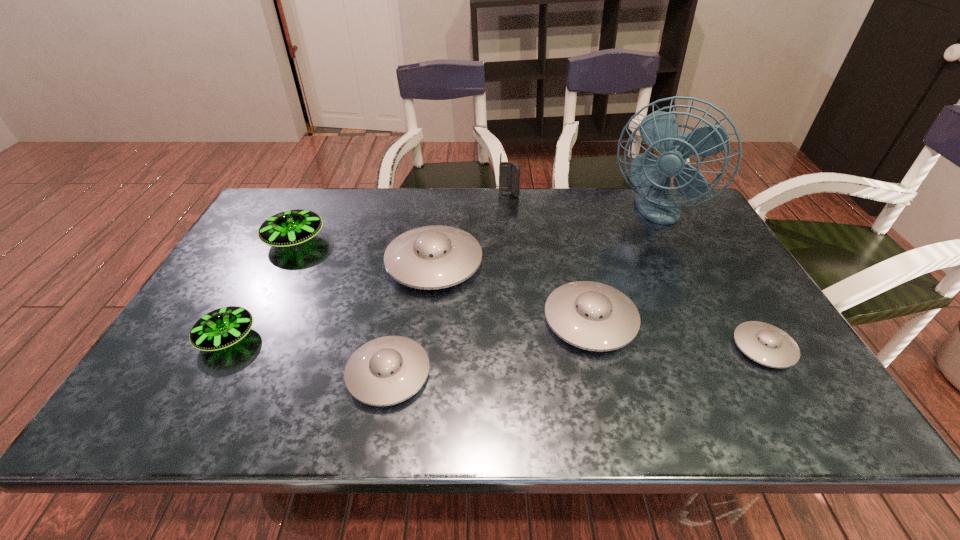
Locate an element on the screen. The width and height of the screenshot is (960, 540). vacant space at the right edge of the desktop is located at coordinates pos(765,308).

This screenshot has width=960, height=540. In the image, there is a desktop. Find the location of `free region at the near left corner`. free region at the near left corner is located at coordinates (189, 404).

This screenshot has width=960, height=540. Identify the location of vacant space at the far right corner of the desktop. (695, 221).

Locate an element on the screen. vacant space at the near right corner is located at coordinates (747, 400).

The width and height of the screenshot is (960, 540). I want to click on blank region between the seventh shortest object and the smallest gray saucer, so click(636, 271).

This screenshot has width=960, height=540. Find the location of `free spot between the tallest object and the shortest object`. free spot between the tallest object and the shortest object is located at coordinates (708, 280).

The width and height of the screenshot is (960, 540). I want to click on free space between the nearer green saucer and the second smallest gray saucer, so click(308, 356).

Locate an element on the screen. empty space between the rightmost gray saucer and the cellular telephone is located at coordinates (636, 271).

Locate an element on the screen. free spot between the cellular telephone and the fan is located at coordinates (581, 204).

Locate an element on the screen. The height and width of the screenshot is (540, 960). vacant space that is in between the biggest gray saucer and the second smallest gray saucer is located at coordinates (411, 319).